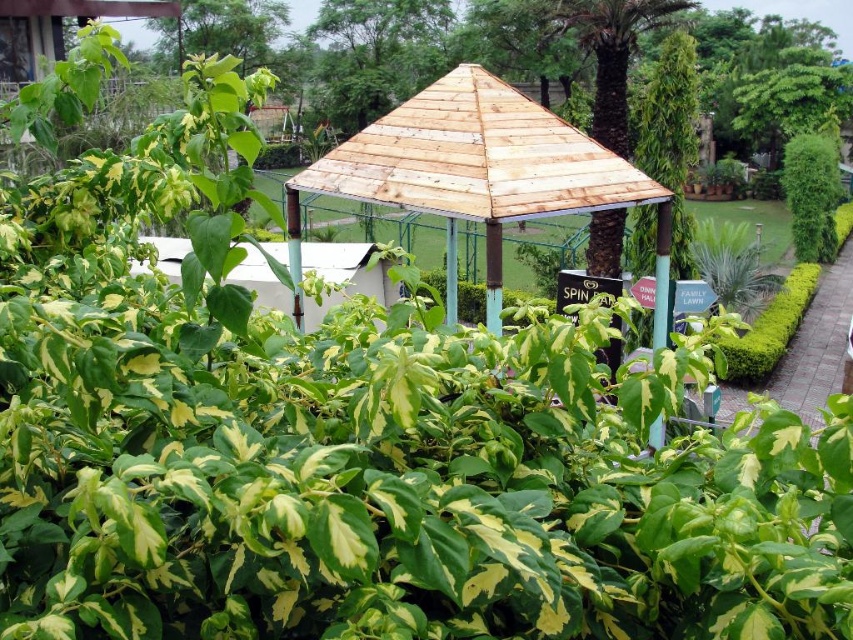
Question: Considering the relative positions of wooden gazebo at center and green leafy bush at upper right in the image provided, where is wooden gazebo at center located with respect to green leafy bush at upper right?

Choices:
 (A) left
 (B) right

Answer: (A)

Question: Can you confirm if brown wooden roof at upper center is positioned below green leafy bush at upper right?

Choices:
 (A) yes
 (B) no

Answer: (B)

Question: Which object is closer to the camera taking this photo?

Choices:
 (A) brown wooden roof at upper center
 (B) wooden gazebo at center

Answer: (B)

Question: Which object is farther from the camera taking this photo?

Choices:
 (A) wooden gazebo at center
 (B) brown wooden roof at upper center
 (C) green leafy bush at upper right

Answer: (B)

Question: Does wooden gazebo at center appear on the right side of brown wooden roof at upper center?

Choices:
 (A) yes
 (B) no

Answer: (A)

Question: Among these objects, which one is farthest from the camera?

Choices:
 (A) green leafy bush at upper right
 (B) brown wooden roof at upper center

Answer: (B)